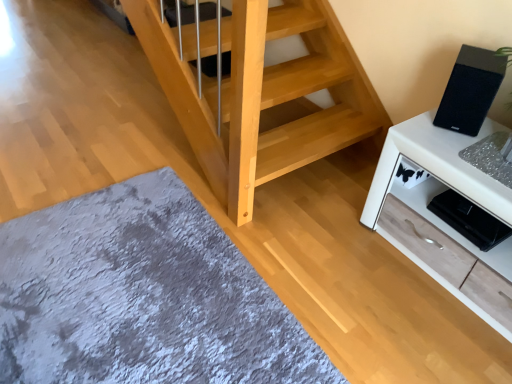
At what (x,y) coordinates should I click in order to perform the action: click on free point in front of black matte speaker at upper right. Please return your answer as a coordinate pair (x, y). The height and width of the screenshot is (384, 512). Looking at the image, I should click on (456, 145).